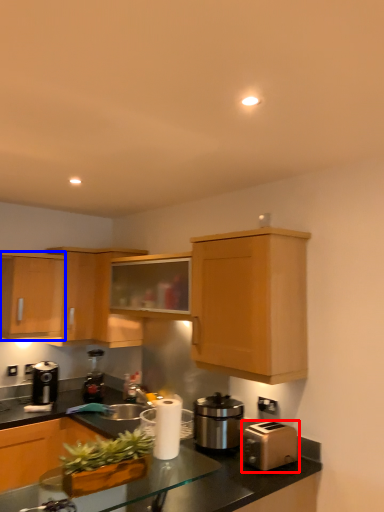
Question: Which of the following is the farthest to the observer, toaster (highlighted by a red box) or cabinetry (highlighted by a blue box)?

Choices:
 (A) toaster
 (B) cabinetry

Answer: (B)